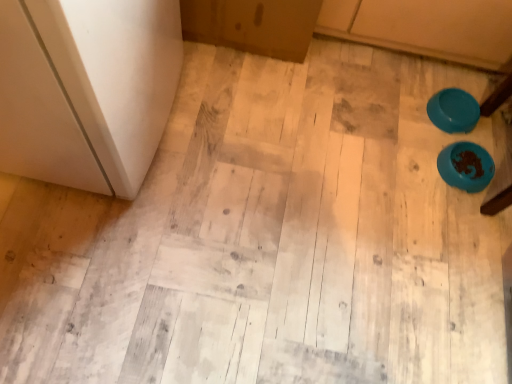
Where is `vacant space in blue plastic bowl at lower right, which appears as the second bowl when viewed from the top (from a real-world perspective)`? Image resolution: width=512 pixels, height=384 pixels. vacant space in blue plastic bowl at lower right, which appears as the second bowl when viewed from the top (from a real-world perspective) is located at coordinates (463, 165).